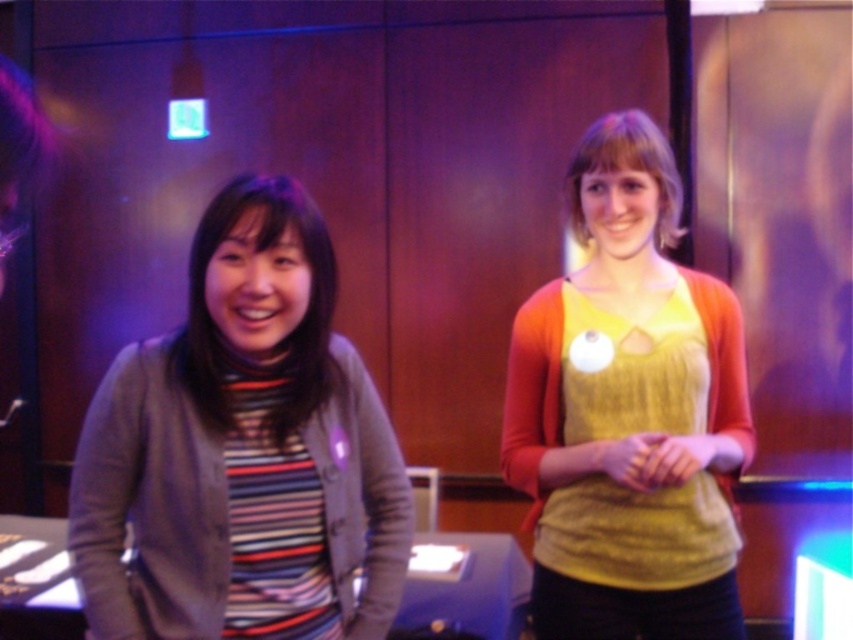
Is point (190, 358) behind point (717, 524)?

No.

Consider the image. How much distance is there between striped knit sweater at left and knitted yellow sweater at center?

striped knit sweater at left is 20.51 inches from knitted yellow sweater at center.

You are a GUI agent. You are given a task and a screenshot of the screen. Output one action in this format:
    pyautogui.click(x=<x>, y=<y>)
    Task: Click on the striped knit sweater at left
    This screenshot has width=853, height=640.
    Given the screenshot: What is the action you would take?
    pyautogui.click(x=242, y=449)